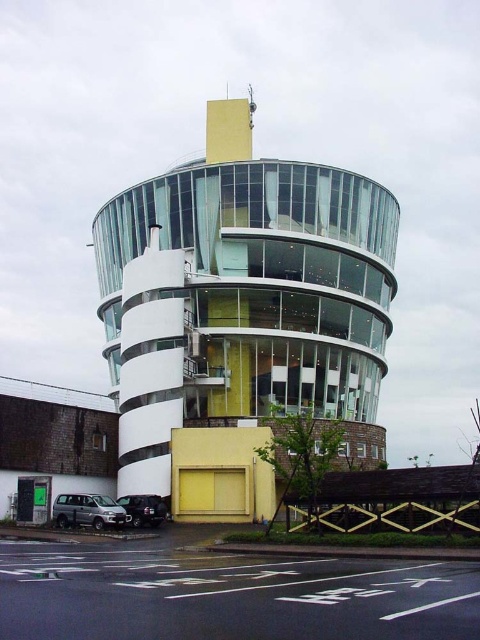
Is silver metallic van at lower left above shiny black suv at lower left?

No, silver metallic van at lower left is not above shiny black suv at lower left.

Does silver metallic van at lower left appear on the left side of shiny black suv at lower left?

Correct, you'll find silver metallic van at lower left to the left of shiny black suv at lower left.

Which is in front, point (113, 515) or point (154, 512)?

Point (113, 515) is more forward.

At what (x,y) coordinates should I click in order to perform the action: click on silver metallic van at lower left. Please return your answer as a coordinate pair (x, y). Image resolution: width=480 pixels, height=640 pixels. Looking at the image, I should click on (87, 512).

Between point (301, 184) and point (90, 522), which one is positioned in front?

Point (90, 522)

Find the location of a particular element. The width and height of the screenshot is (480, 640). transparent glass tower at center is located at coordinates (241, 316).

Locate an element on the screen. transparent glass tower at center is located at coordinates (241, 316).

Image resolution: width=480 pixels, height=640 pixels. In order to click on transparent glass tower at center in this screenshot , I will do `click(241, 316)`.

Is point (126, 312) positioned after point (132, 506)?

Yes, it is behind point (132, 506).

Between point (383, 324) and point (137, 497), which one is positioned in front?

Point (137, 497) is more forward.

At what (x,y) coordinates should I click in order to perform the action: click on transparent glass tower at center. Please return your answer as a coordinate pair (x, y). The image size is (480, 640). Looking at the image, I should click on coord(241,316).